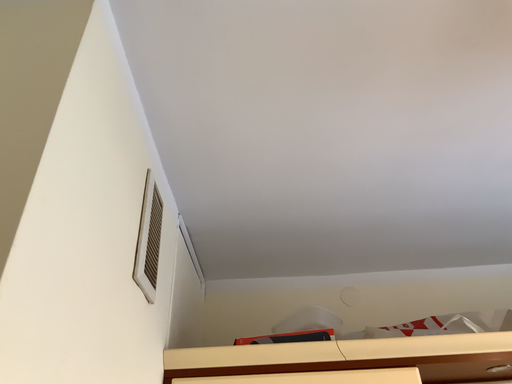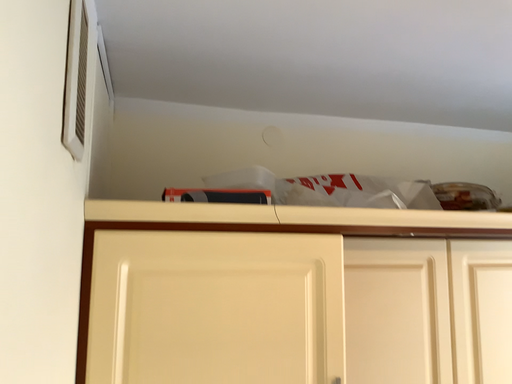
Question: Which way did the camera rotate in the video?

Choices:
 (A) rotated upward
 (B) rotated downward

Answer: (B)